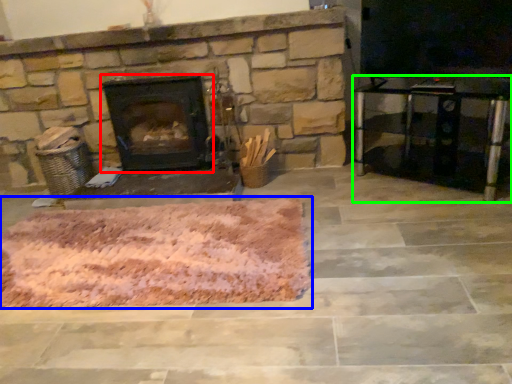
Question: Which object is the closest to the wood burning stove (highlighted by a red box)? Choose among these: mat (highlighted by a blue box) or entertainment center (highlighted by a green box).

Choices:
 (A) mat
 (B) entertainment center

Answer: (A)